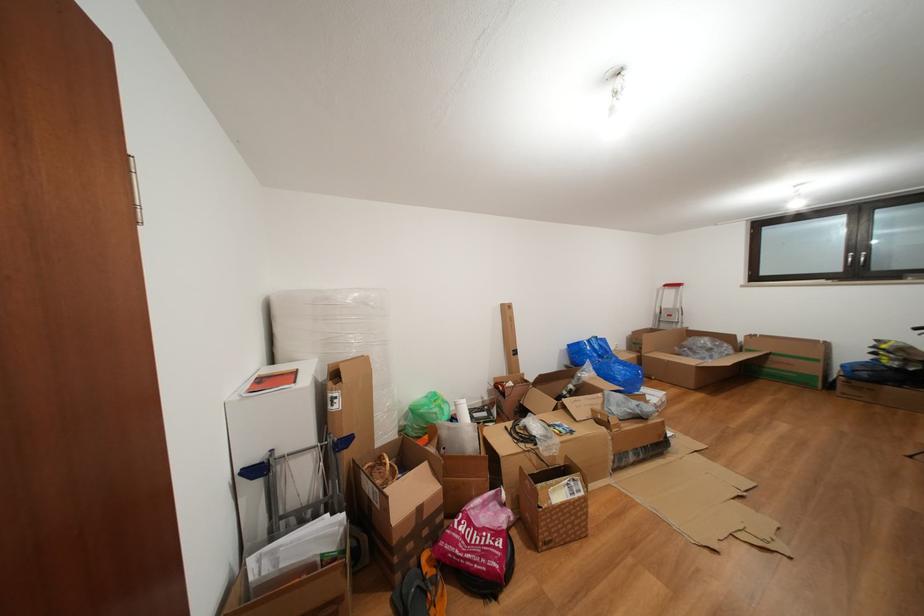
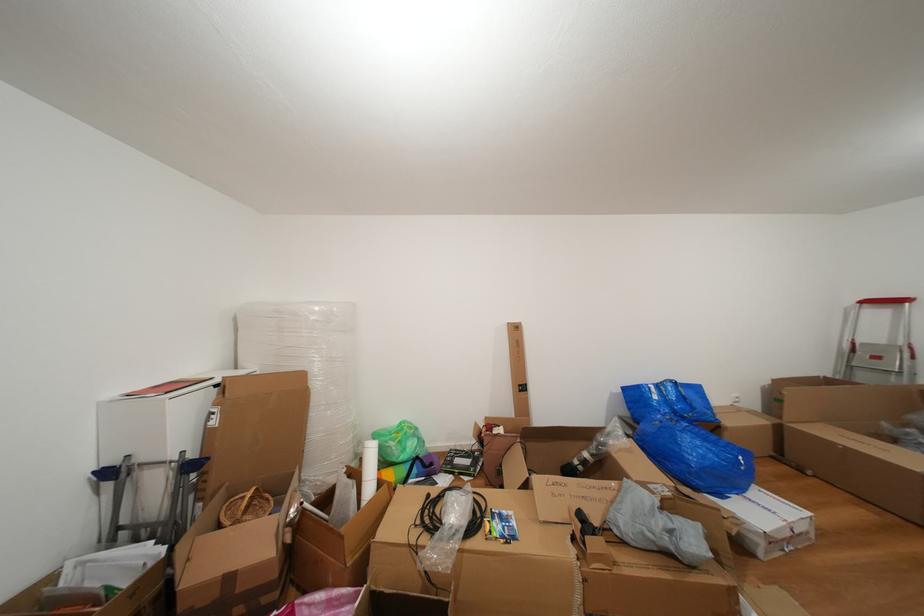
In a continuous first-person perspective shot, in which direction is the camera moving?

The cameraman walked toward right, forward.